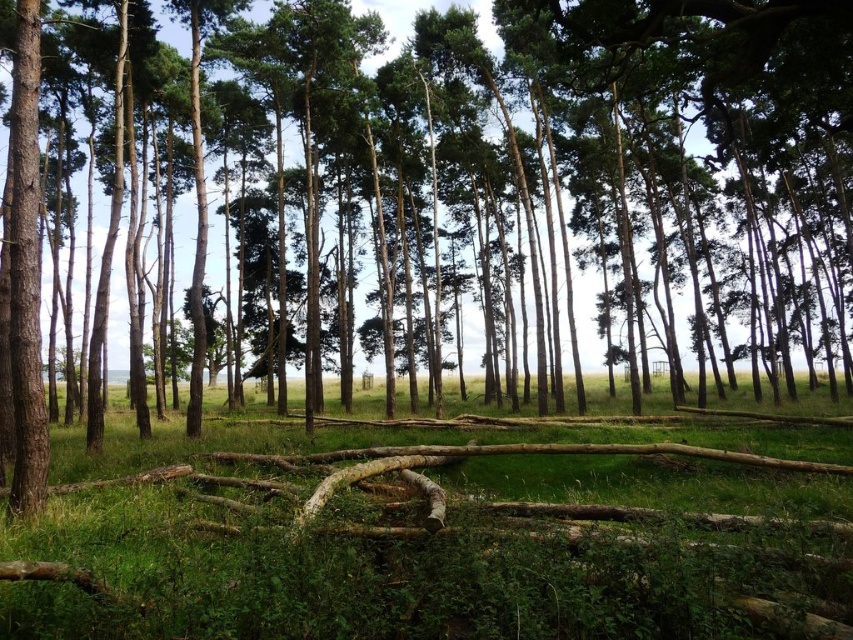
Can you confirm if green grassy at center is thinner than smooth brown tree trunk at left?

No.

Is green grassy at center bigger than smooth brown tree trunk at left?

Correct, green grassy at center is larger in size than smooth brown tree trunk at left.

Where is `green grassy at center`? This screenshot has width=853, height=640. green grassy at center is located at coordinates (437, 538).